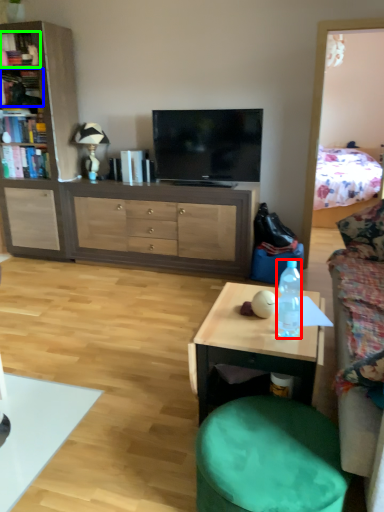
Question: Considering the real-world distances, which object is farthest from bottle (highlighted by a red box)? book (highlighted by a blue box) or book (highlighted by a green box)?

Choices:
 (A) book
 (B) book

Answer: (A)